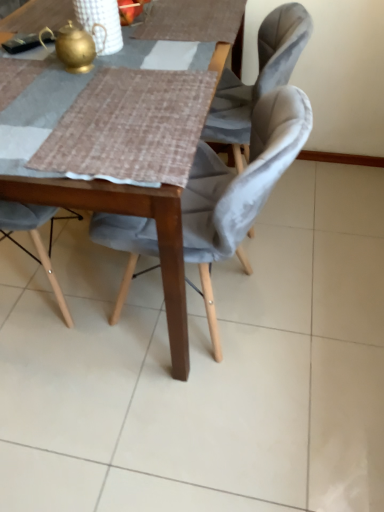
I want to click on velvet grey chair at center, so click(240, 187).

The image size is (384, 512). I want to click on gold metallic teapot at upper left, so click(x=73, y=47).

Is wooden table at center not near gold metallic teapot at upper left?

No, wooden table at center is not far away from gold metallic teapot at upper left.

Could you tell me if wooden table at center is turned towards gold metallic teapot at upper left?

No, wooden table at center is not facing towards gold metallic teapot at upper left.

Can you tell me how much wooden table at center and gold metallic teapot at upper left differ in facing direction?

The angular difference between wooden table at center and gold metallic teapot at upper left is 5.72 degrees.

From a real-world perspective, between wooden table at center and velvet grey chair at center, who is vertically lower?

In real-world perspective, velvet grey chair at center is lower.

From their relative heights in the image, would you say wooden table at center is taller or shorter than velvet grey chair at center?

Considering their sizes, wooden table at center has more height than velvet grey chair at center.

From the image's perspective, is wooden table at center positioned above or below velvet grey chair at center?

From the image's perspective, wooden table at center appears above velvet grey chair at center.

Find the location of a particular element. Image resolution: width=384 pixels, height=512 pixels. table located in front of the velvet grey chair at center is located at coordinates (127, 214).

Considering the sizes of objects velvet grey chair at center and gold metallic teapot at upper left in the image provided, who is wider, velvet grey chair at center or gold metallic teapot at upper left?

With larger width is velvet grey chair at center.

How distant is velvet grey chair at center from gold metallic teapot at upper left?

A distance of 18.80 inches exists between velvet grey chair at center and gold metallic teapot at upper left.

From a real-world perspective, which object rests below the other?

velvet grey chair at center.

Is velvet grey chair at center oriented towards gold metallic teapot at upper left?

A: No, velvet grey chair at center is not oriented towards gold metallic teapot at upper left.

Are gold metallic teapot at upper left and velvet grey chair at center far apart?

No, gold metallic teapot at upper left is not far from velvet grey chair at center.

Who is bigger, gold metallic teapot at upper left or velvet grey chair at center?

Bigger between the two is velvet grey chair at center.

Does point (66, 40) lie behind point (101, 214)?

That is False.

Is gold metallic teapot at upper left taller or shorter than velvet grey chair at center?

In the image, gold metallic teapot at upper left appears to be shorter than velvet grey chair at center.

Who is shorter, velvet grey chair at center or wooden table at center?

Standing shorter between the two is velvet grey chair at center.

From the image's perspective, is velvet grey chair at center positioned above or below wooden table at center?

Based on their image positions, velvet grey chair at center is located beneath wooden table at center.

Which is behind, point (100, 222) or point (42, 8)?

Point (42, 8)

Can you confirm if gold metallic teapot at upper left is shorter than wooden table at center?

Correct, gold metallic teapot at upper left is not as tall as wooden table at center.

Can you tell me how much gold metallic teapot at upper left and wooden table at center differ in facing direction?

The angular difference between gold metallic teapot at upper left and wooden table at center is 5.72 degrees.

Looking at this image, is gold metallic teapot at upper left positioned behind wooden table at center?

Yes, the depth of gold metallic teapot at upper left is greater than that of wooden table at center.

From the image's perspective, would you say gold metallic teapot at upper left is shown under wooden table at center?

Actually, gold metallic teapot at upper left appears above wooden table at center in the image.

The width and height of the screenshot is (384, 512). I want to click on tea pot above the wooden table at center (from a real-world perspective), so click(x=73, y=47).

You are a GUI agent. You are given a task and a screenshot of the screen. Output one action in this format:
    pyautogui.click(x=<x>, y=<y>)
    Task: Click on the chair beneath the wooden table at center (from a real-world perspective)
    The width and height of the screenshot is (384, 512).
    Given the screenshot: What is the action you would take?
    pyautogui.click(x=240, y=187)

From the picture: Looking at the image, which one is located closer to velvet grey chair at center, gold metallic teapot at upper left or wooden table at center?

wooden table at center is positioned closer to the anchor velvet grey chair at center.

Which object lies nearer to the anchor point wooden table at center, gold metallic teapot at upper left or velvet grey chair at center?

Among the two, velvet grey chair at center is located nearer to wooden table at center.

In the scene shown: Considering their positions, is wooden table at center positioned further to velvet grey chair at center than gold metallic teapot at upper left?

gold metallic teapot at upper left.

When comparing their distances from gold metallic teapot at upper left, does wooden table at center or velvet grey chair at center seem further?

The object further to gold metallic teapot at upper left is wooden table at center.

Looking at the image, which one is located further to gold metallic teapot at upper left, velvet grey chair at center or wooden table at center?

wooden table at center is positioned further to the anchor gold metallic teapot at upper left.

Looking at the image, which one is located closer to wooden table at center, velvet grey chair at center or gold metallic teapot at upper left?

velvet grey chair at center is positioned closer to the anchor wooden table at center.

Find the location of a particular element. table between gold metallic teapot at upper left and velvet grey chair at center in the vertical direction is located at coordinates (127, 214).